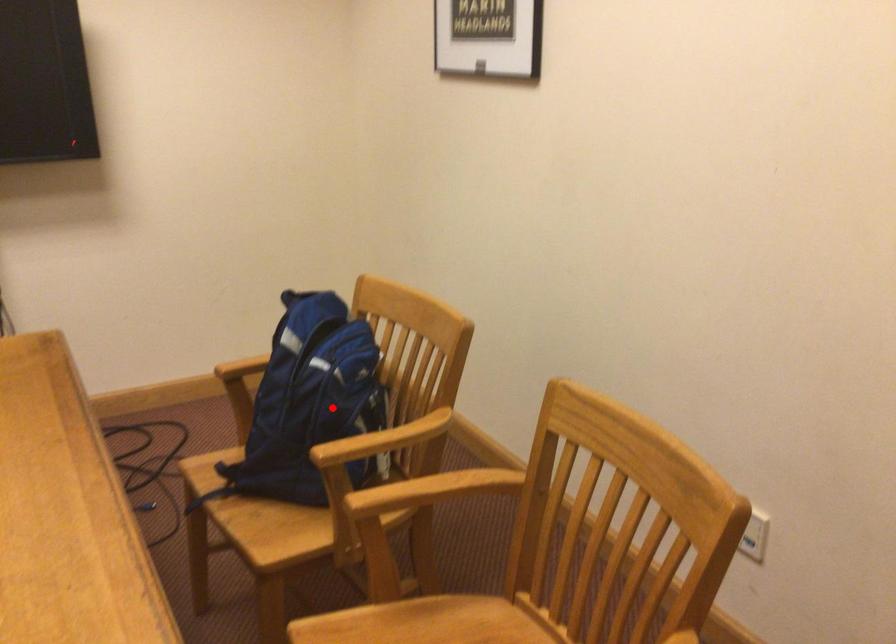
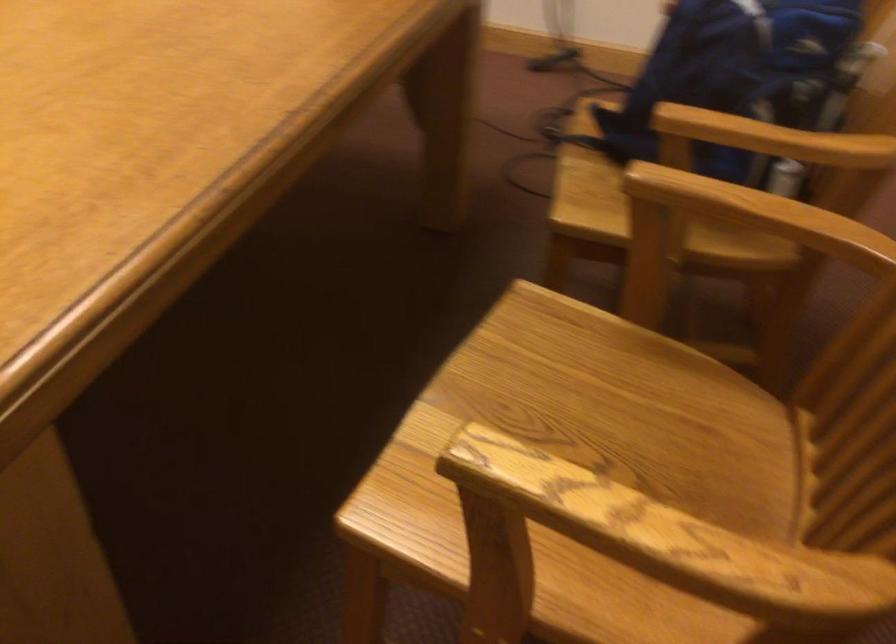
Question: I am providing you with two images of the same scene from different viewpoints. Given a red point in image1, look at the same physical point in image2. Is it:

Choices:
 (A) Closer to the viewpoint
 (B) Farther from the viewpoint

Answer: (A)